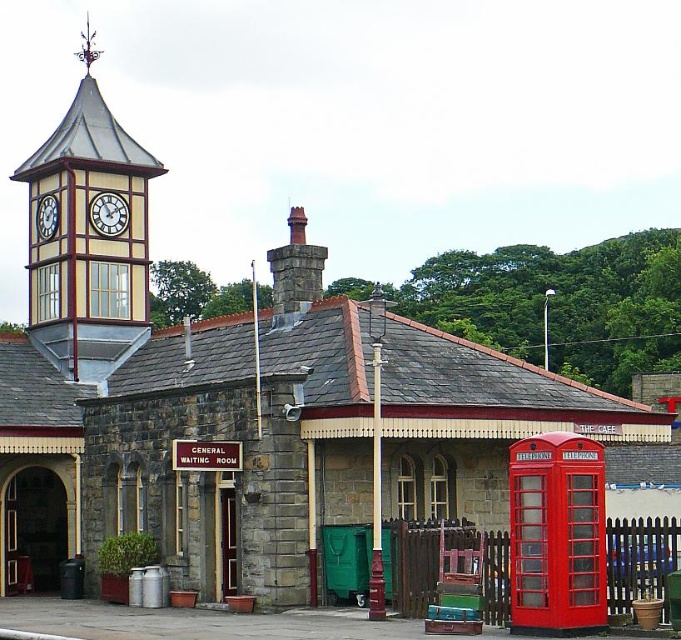
You are an architect examining the historic railway station. You notice the wooden clock tower at upper left and the white clock face at upper left. Which of these two objects is larger in size?

The wooden clock tower at upper left is bigger than the white clock face at upper left according to the description.

You are a visitor at the historic railway station and want to take a photo of both the wooden clock tower at upper left and the white clock face at upper left. Based on their positions, which one should you focus on first to ensure both are in the frame?

Since the wooden clock tower at upper left is located above the white clock face at upper left, you should focus on the wooden clock tower at upper left first to ensure both are in the frame.

You are standing at the entrance of the historic railway station and notice two points marked on the clock tower. The first point is at coordinate point (48, 292) and the second is at point (57, 220). Which point is closer to your current position?

Point (48, 292) is further to the camera than point (57, 220), so the second point at (57, 220) is closer to your current position.